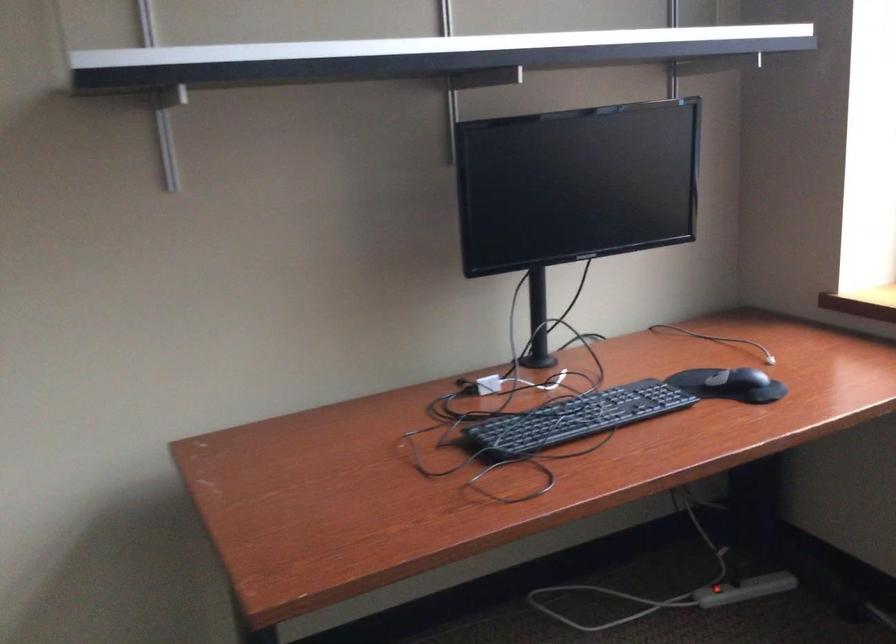
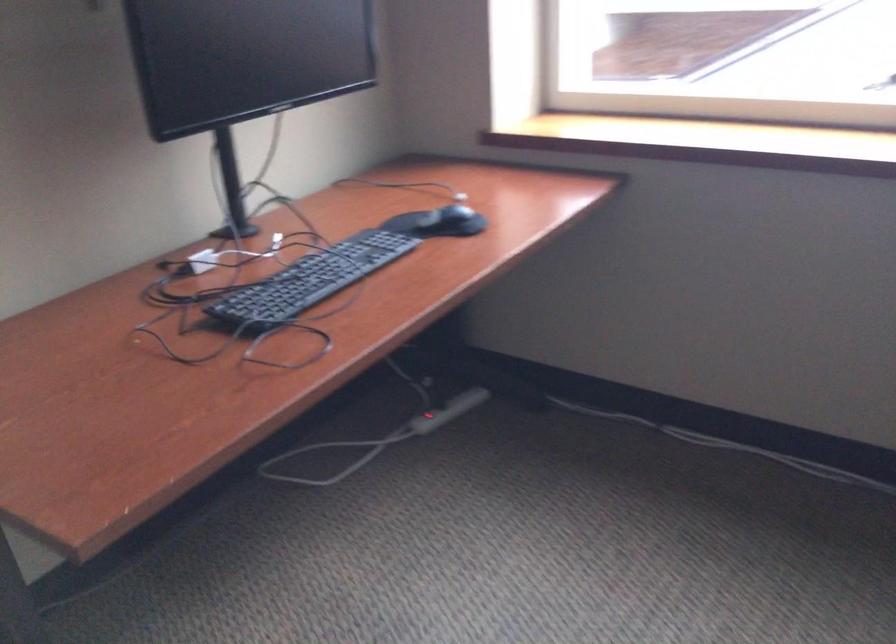
Question: The images are taken continuously from a first-person perspective. In which direction is your viewpoint rotating?

Choices:
 (A) Left
 (B) Right
 (C) Up
 (D) Down

Answer: (B)